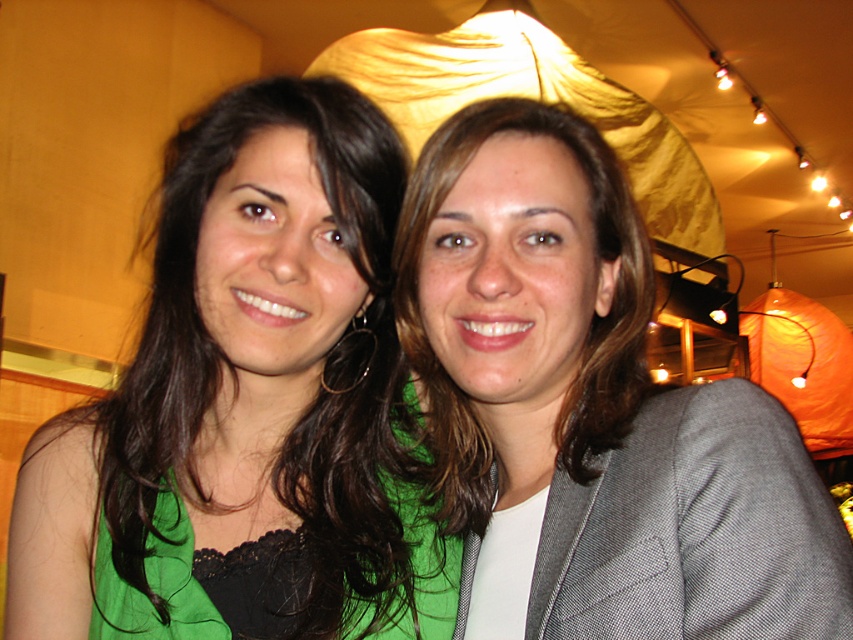
You are a photographer at the event and need to adjust the lighting to ensure both the green fabric jacket at upper right and the matte gray blazer at center are well lit. Considering their sizes, which jacket should you focus your light on first to ensure proper exposure?

The green fabric jacket at upper right is larger in size than the matte gray blazer at center, so you should focus the light on the green fabric jacket at upper right first to ensure its larger surface area is properly illuminated.

You are at a social event and want to take a photo of both the green fabric jacket at upper right and the matte gray blazer at center. Which jacket is positioned more to the right side of the scene?

The green fabric jacket at upper right is positioned more to the right side of the scene compared to the matte gray blazer at center.